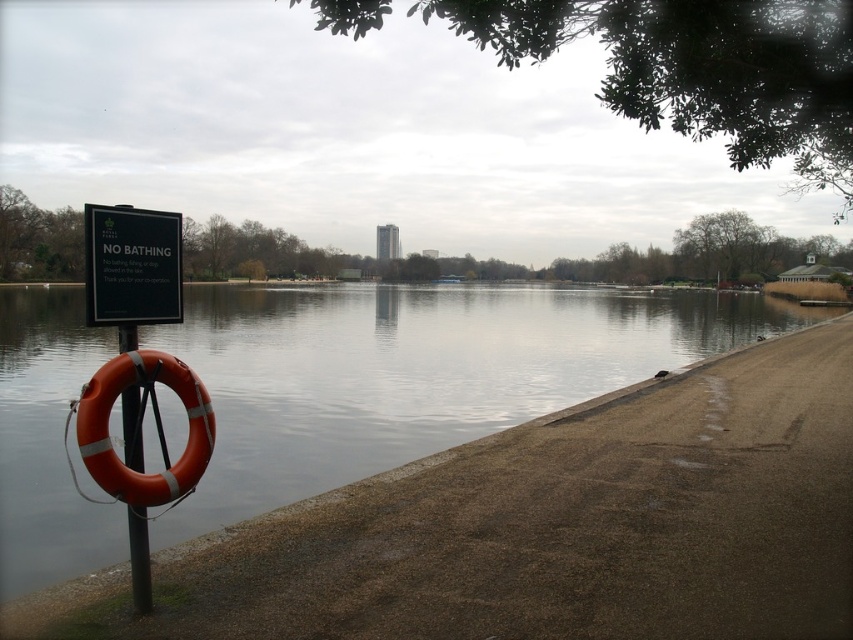
How much distance is there between smooth concrete river at lower left and orange rubber ring at left?

smooth concrete river at lower left is 36.33 meters from orange rubber ring at left.

Does point (282, 305) lie in front of point (135, 344)?

No, (282, 305) is further to viewer.

Where is `smooth concrete river at lower left`? smooth concrete river at lower left is located at coordinates (415, 372).

From the picture: Does smooth concrete river at lower left appear over black plastic sign at left?

Indeed, smooth concrete river at lower left is positioned over black plastic sign at left.

Is point (41, 468) closer to camera compared to point (167, 248)?

No, (41, 468) is further to viewer.

Is point (221, 388) closer to camera compared to point (164, 312)?

No, (221, 388) is further to viewer.

The height and width of the screenshot is (640, 853). I want to click on smooth concrete river at lower left, so click(x=415, y=372).

Does point (96, 476) lie in front of point (117, 275)?

Yes.

Does orange rubber life jacket at left have a greater width compared to black plastic sign at left?

Yes.

What are the coordinates of `orange rubber life jacket at left` in the screenshot? It's located at 155,422.

At what (x,y) coordinates should I click in order to perform the action: click on orange rubber life jacket at left. Please return your answer as a coordinate pair (x, y). This screenshot has height=640, width=853. Looking at the image, I should click on (155, 422).